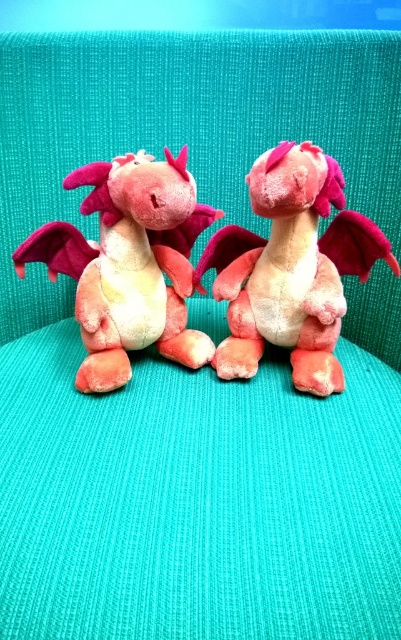
Question: Which of the following is the farthest from the observer?

Choices:
 (A) (281, 304)
 (B) (111, 227)

Answer: (A)

Question: Can you confirm if velvet pink plush dragon at center is positioned to the right of velvet pink dragon at left?

Choices:
 (A) yes
 (B) no

Answer: (A)

Question: Does velvet pink plush dragon at center appear under velvet pink dragon at left?

Choices:
 (A) yes
 (B) no

Answer: (B)

Question: Is velvet pink plush dragon at center to the right of velvet pink dragon at left from the viewer's perspective?

Choices:
 (A) yes
 (B) no

Answer: (A)

Question: Which object appears closest to the camera in this image?

Choices:
 (A) velvet pink dragon at left
 (B) velvet pink plush dragon at center

Answer: (B)